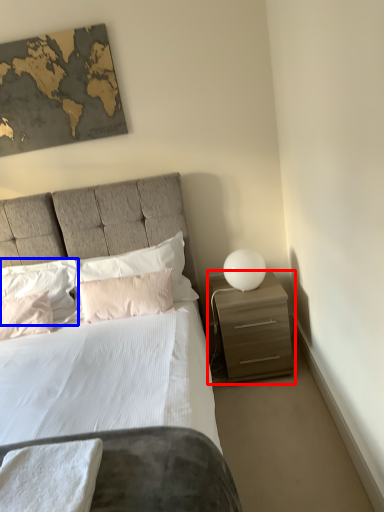
Question: Which of the following is the closest to the observer, nightstand (highlighted by a red box) or pillow (highlighted by a blue box)?

Choices:
 (A) nightstand
 (B) pillow

Answer: (A)